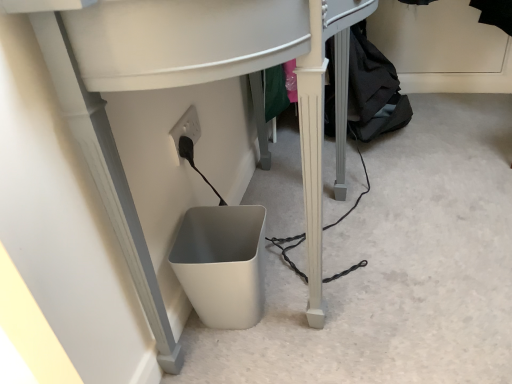
Where is `free region under white plastic computer desk at lower center (from a real-world perspective)`? free region under white plastic computer desk at lower center (from a real-world perspective) is located at coordinates (298, 250).